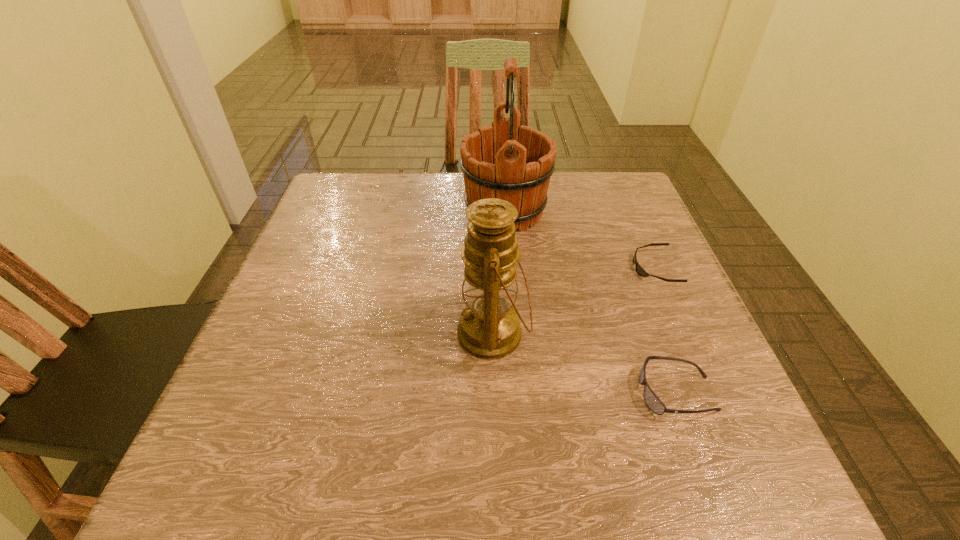
Locate an element on the screen. The height and width of the screenshot is (540, 960). free space between the farthest object and the shortest object is located at coordinates (580, 240).

Identify which object is the second nearest to the tallest object. Please provide its 2D coordinates. Your answer should be formatted as a tuple, i.e. [(x, y)], where the tuple contains the x and y coordinates of a point satisfying the conditions above.

[(489, 328)]

Locate which object ranks in proximity to the wine bucket. Please provide its 2D coordinates. Your answer should be formatted as a tuple, i.e. [(x, y)], where the tuple contains the x and y coordinates of a point satisfying the conditions above.

[(640, 271)]